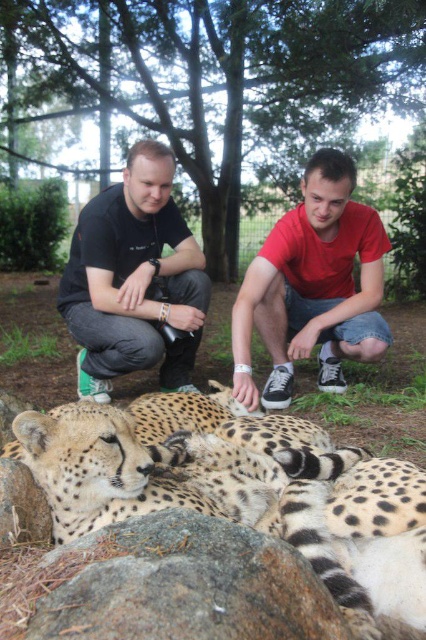
Between spotted fur cheetah at center and red matte shirt at center, which one has more height?

red matte shirt at center

Who is lower down, spotted fur cheetah at center or red matte shirt at center?

spotted fur cheetah at center is below.

At what (x,y) coordinates should I click in order to perform the action: click on spotted fur cheetah at center. Please return your answer as a coordinate pair (x, y). The height and width of the screenshot is (640, 426). Looking at the image, I should click on (238, 488).

Which is below, spotted fur cheetah at center or gray rough rock at lower center?

gray rough rock at lower center

Is spotted fur cheetah at center closer to camera compared to gray rough rock at lower center?

No.

Find the location of `spotted fur cheetah at center`. spotted fur cheetah at center is located at coordinates (238, 488).

Does gray rough rock at lower center have a greater width compared to black matte shirt at center?

Incorrect, gray rough rock at lower center's width does not surpass black matte shirt at center's.

At what (x,y) coordinates should I click in order to perform the action: click on gray rough rock at lower center. Please return your answer as a coordinate pair (x, y). The height and width of the screenshot is (640, 426). Looking at the image, I should click on (189, 586).